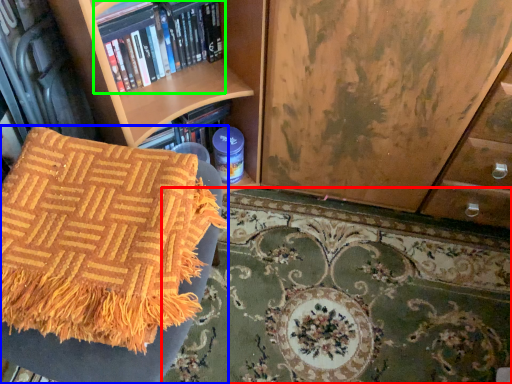
Question: Estimate the real-world distances between objects in this image. Which object is farther from mat (highlighted by a red box), furniture (highlighted by a blue box) or book (highlighted by a green box)?

Choices:
 (A) furniture
 (B) book

Answer: (B)